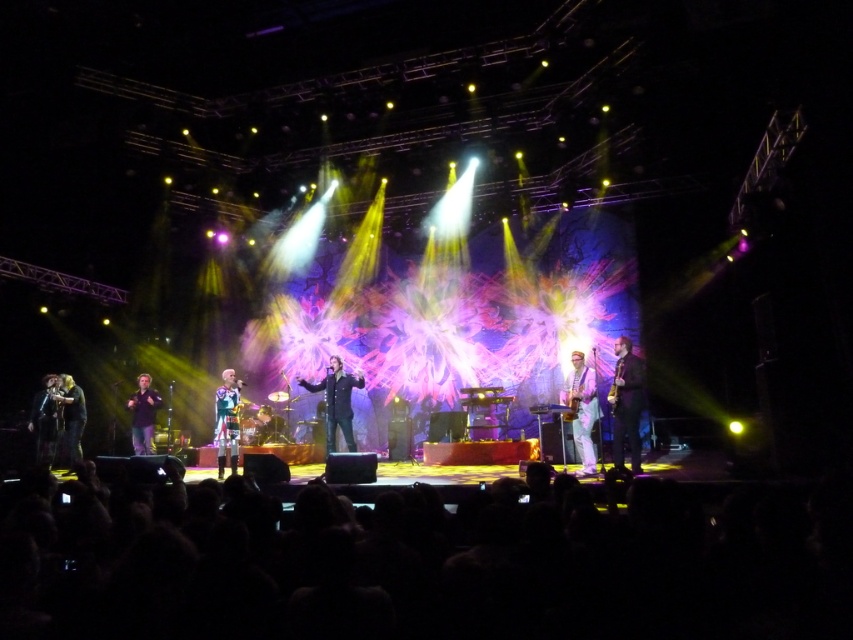
Which is in front, point (630, 394) or point (61, 400)?

Positioned in front is point (630, 394).

Which of these two, brown leather jacket at right or dark brown leather jacket at left, stands shorter?

dark brown leather jacket at left is shorter.

The width and height of the screenshot is (853, 640). What do you see at coordinates (625, 403) in the screenshot?
I see `brown leather jacket at right` at bounding box center [625, 403].

Find the location of a particular element. brown leather jacket at right is located at coordinates (625, 403).

In the scene shown: Who is positioned more to the left, black leather jacket at center or matte black microphone at left?

matte black microphone at left

Is the position of black leather jacket at center more distant than that of matte black microphone at left?

No, black leather jacket at center is in front of matte black microphone at left.

Find the location of a particular element. The image size is (853, 640). black leather jacket at center is located at coordinates (335, 401).

Consider the image. Who is more distant from viewer, (584, 413) or (51, 385)?

Positioned behind is point (51, 385).

Between white glossy saxophone at center and matte black microphone at left, which one appears on the right side from the viewer's perspective?

white glossy saxophone at center

Which is in front, point (578, 353) or point (51, 449)?

Point (578, 353) is more forward.

At what (x,y) coordinates should I click in order to perform the action: click on white glossy saxophone at center. Please return your answer as a coordinate pair (x, y). Image resolution: width=853 pixels, height=640 pixels. Looking at the image, I should click on (582, 410).